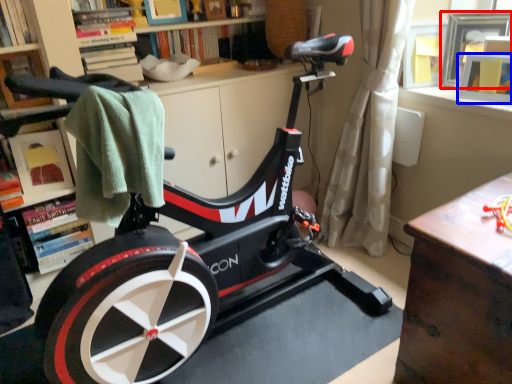
Question: Among these objects, which one is nearest to the camera, picture frame (highlighted by a red box) or picture frame (highlighted by a blue box)?

Choices:
 (A) picture frame
 (B) picture frame

Answer: (B)